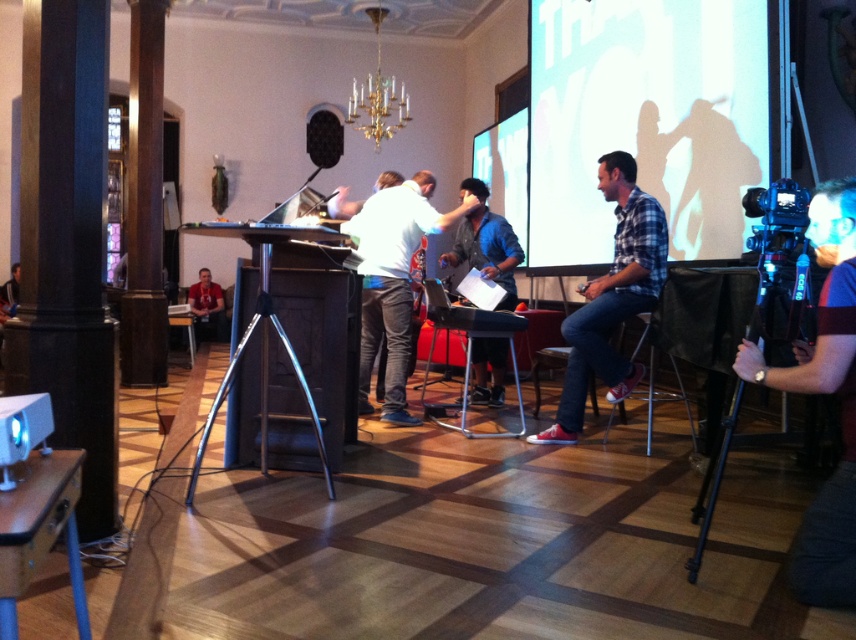
You are a photographer in the conference room and you need to position your camera so that both the black matte speaker at center and the dark blue jeans at center are in the frame. Which object should you ensure is placed higher in the frame to include both?

The black matte speaker at center is taller than the dark blue jeans at center, so you should position the camera to ensure the black matte speaker at center is placed higher in the frame to accommodate its height and include both objects in the shot.

You are a photographer in the conference room. You need to adjust the distance between the blue fabric camera at right and the matte red shirt at lower left to exactly 25 feet. Is the current distance sufficient?

A: The blue fabric camera at right and the matte red shirt at lower left are currently 24.85 feet apart, which is just 0.15 feet less than the desired 25 feet. To achieve the exact distance, you would need to move one of the objects slightly closer by approximately 0.15 feet.

You are organizing a small event and need to place a decorative item on the table. The plaid cotton shirt at right and the black matte speaker at center are both candidates. Which one is bigger and thus more suitable for the table centerpiece?

The plaid cotton shirt at right is larger in size than the black matte speaker at center, so it would be more suitable as the table centerpiece.